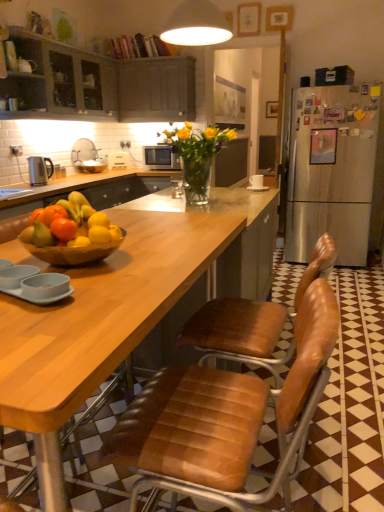
Question: Can you confirm if silver metallic microwave at center is wider than polished stainless steel kettle at left?

Choices:
 (A) no
 (B) yes

Answer: (B)

Question: Can you confirm if silver metallic microwave at center is positioned to the left of polished stainless steel kettle at left?

Choices:
 (A) yes
 (B) no

Answer: (B)

Question: Is silver metallic microwave at center touching polished stainless steel kettle at left?

Choices:
 (A) yes
 (B) no

Answer: (B)

Question: Would you say silver metallic microwave at center contains polished stainless steel kettle at left?

Choices:
 (A) yes
 (B) no

Answer: (B)

Question: Is silver metallic microwave at center behind polished stainless steel kettle at left?

Choices:
 (A) no
 (B) yes

Answer: (B)

Question: Is silver metallic microwave at center oriented away from polished stainless steel kettle at left?

Choices:
 (A) yes
 (B) no

Answer: (B)

Question: Is orange matte at center directly adjacent to translucent glass vase at center?

Choices:
 (A) yes
 (B) no

Answer: (B)

Question: From a real-world perspective, is orange matte at center positioned over translucent glass vase at center based on gravity?

Choices:
 (A) yes
 (B) no

Answer: (B)

Question: Is the depth of orange matte at center less than that of translucent glass vase at center?

Choices:
 (A) yes
 (B) no

Answer: (A)

Question: Is orange matte at center not within translucent glass vase at center?

Choices:
 (A) no
 (B) yes

Answer: (B)

Question: Does orange matte at center have a greater height compared to translucent glass vase at center?

Choices:
 (A) yes
 (B) no

Answer: (B)

Question: From the image's perspective, would you say orange matte at center is positioned over translucent glass vase at center?

Choices:
 (A) no
 (B) yes

Answer: (A)

Question: Is matte gray cabinets at upper left, the 2th cabinetry when ordered from right to left, a part of orange matte at center?

Choices:
 (A) yes
 (B) no

Answer: (B)